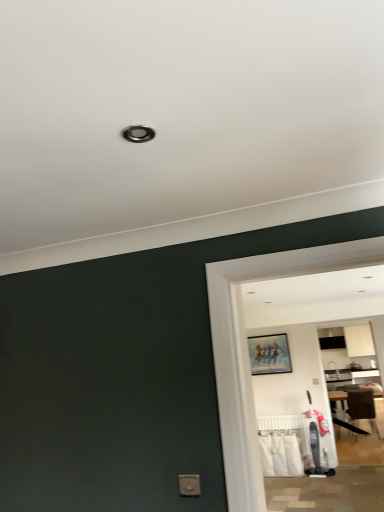
Question: From the image's perspective, is white plastic radiator at lower center positioned above or below brown fabric chair at right?

Choices:
 (A) above
 (B) below

Answer: (A)

Question: From a real-world perspective, is white plastic radiator at lower center positioned above or below brown fabric chair at right?

Choices:
 (A) below
 (B) above

Answer: (A)

Question: Considering the real-world distances, which object is closest to the matte wooden picture frame at center?

Choices:
 (A) white fabric laundry at lower right
 (B) brown fabric chair at right
 (C) white plastic radiator at lower center

Answer: (C)

Question: Estimate the real-world distances between objects in this image. Which object is closer to the white fabric laundry at lower right?

Choices:
 (A) matte wooden picture frame at center
 (B) white plastic radiator at lower center
 (C) brown fabric chair at right

Answer: (B)